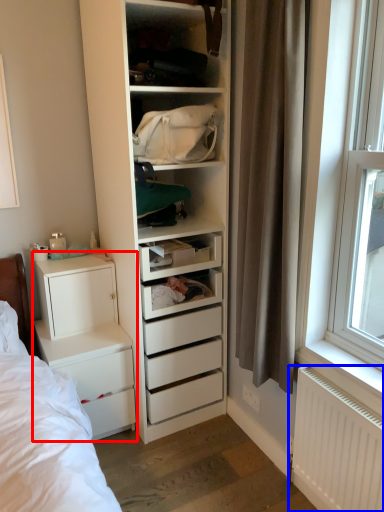
Question: Which point is further to the camera, chest of drawers (highlighted by a red box) or radiator (highlighted by a blue box)?

Choices:
 (A) chest of drawers
 (B) radiator

Answer: (A)